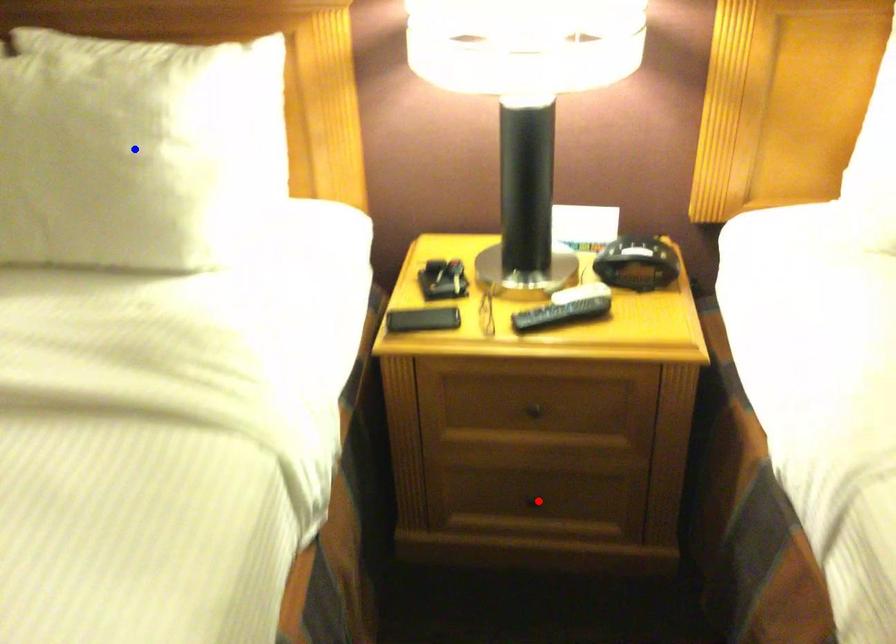
Question: In the image, two points are highlighted. Which point is nearer to the camera? Reply with the corresponding letter.

Choices:
 (A) blue point
 (B) red point

Answer: (A)